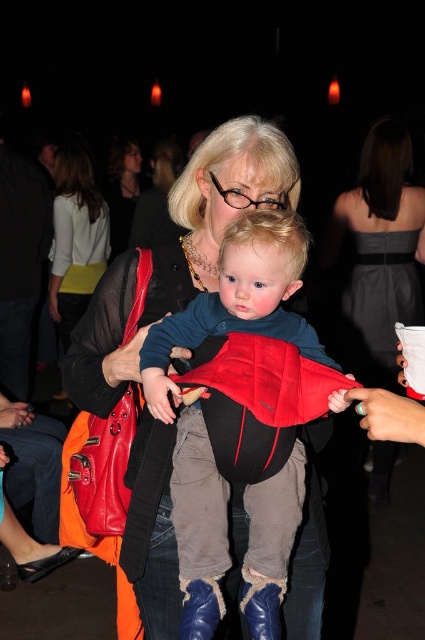
Question: Estimate the real-world distances between objects in this image. Which object is closer to the gray satin dress at upper right?

Choices:
 (A) matte black baby carrier at center
 (B) matte white blouse at upper left
 (C) matte black jacket at upper center

Answer: (B)

Question: Is matte black baby carrier at center behind gray satin dress at upper right?

Choices:
 (A) no
 (B) yes

Answer: (A)

Question: Can you confirm if matte black baby carrier at center is positioned to the left of matte black jacket at upper center?

Choices:
 (A) yes
 (B) no

Answer: (B)

Question: Which of the following is the closest to the observer?

Choices:
 (A) (396, 232)
 (B) (127, 176)
 (C) (235, 252)

Answer: (C)

Question: Does gray satin dress at upper right appear on the right side of matte white blouse at upper left?

Choices:
 (A) yes
 (B) no

Answer: (A)

Question: Which of the following is the closest to the observer?

Choices:
 (A) (360, 458)
 (B) (122, 156)

Answer: (A)